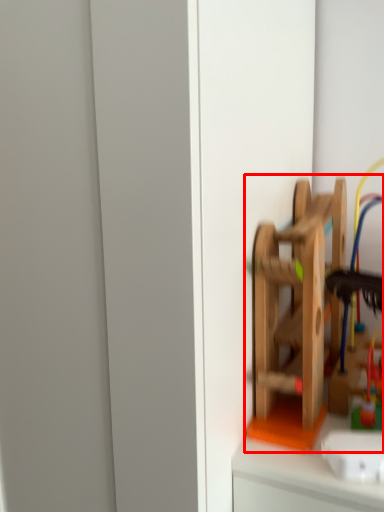
Question: In this image, where is toy (annotated by the red box) located relative to toy?

Choices:
 (A) left
 (B) right

Answer: (A)